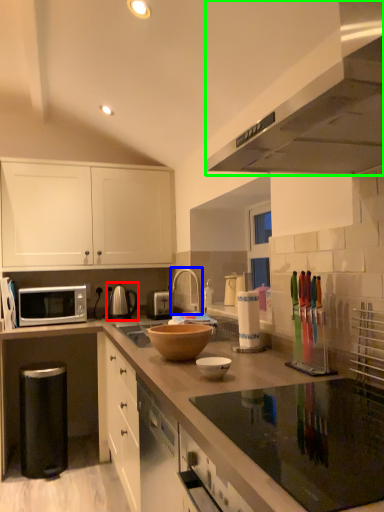
Question: Which object is the closest to the tea pot (highlighted by a red box)? Choose among these: tap (highlighted by a blue box) or kitchen appliance (highlighted by a green box).

Choices:
 (A) tap
 (B) kitchen appliance

Answer: (A)